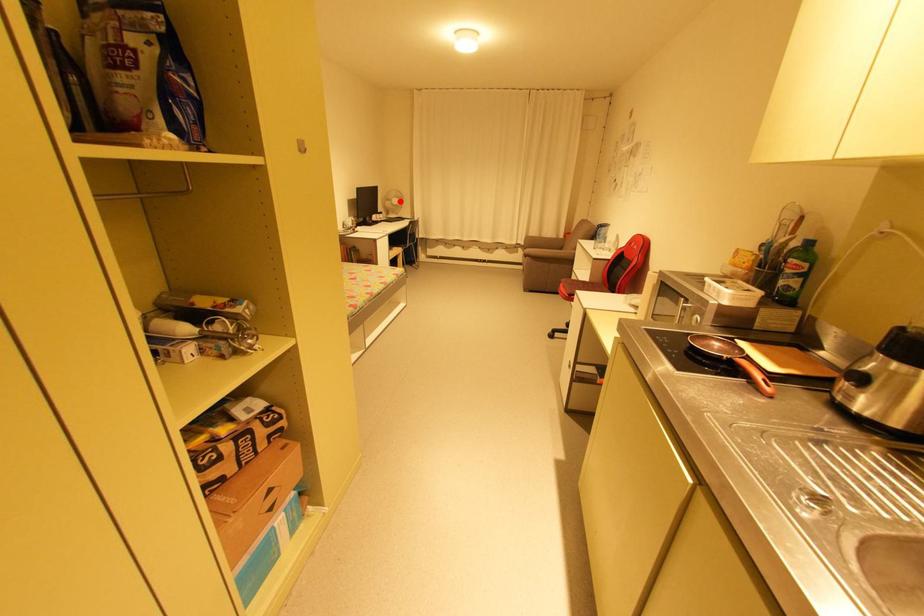
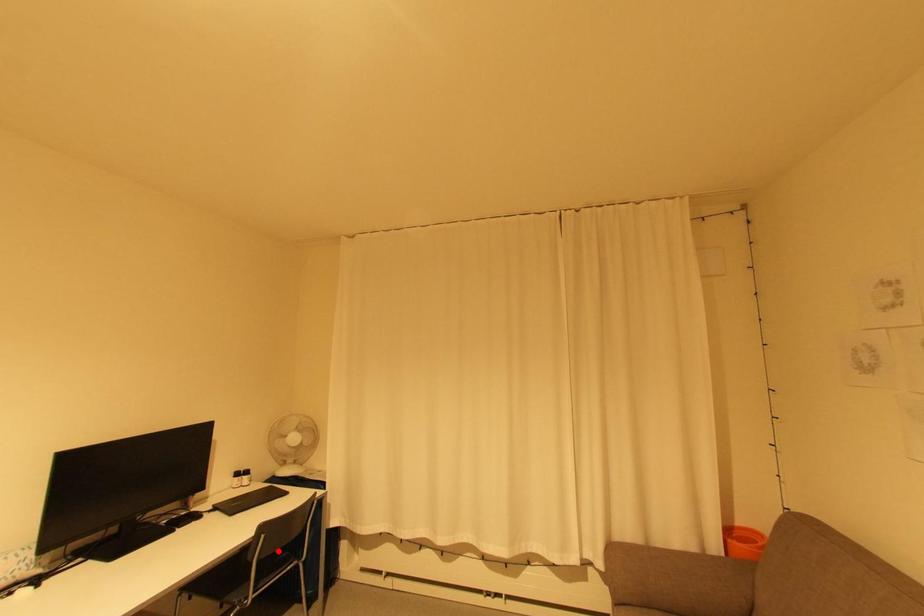
I am providing you with two images of the same scene from different viewpoints. A red point is marked on the first image and another point is marked on the second image. Does the point marked in image1 correspond to the same location as the one in image2?

No